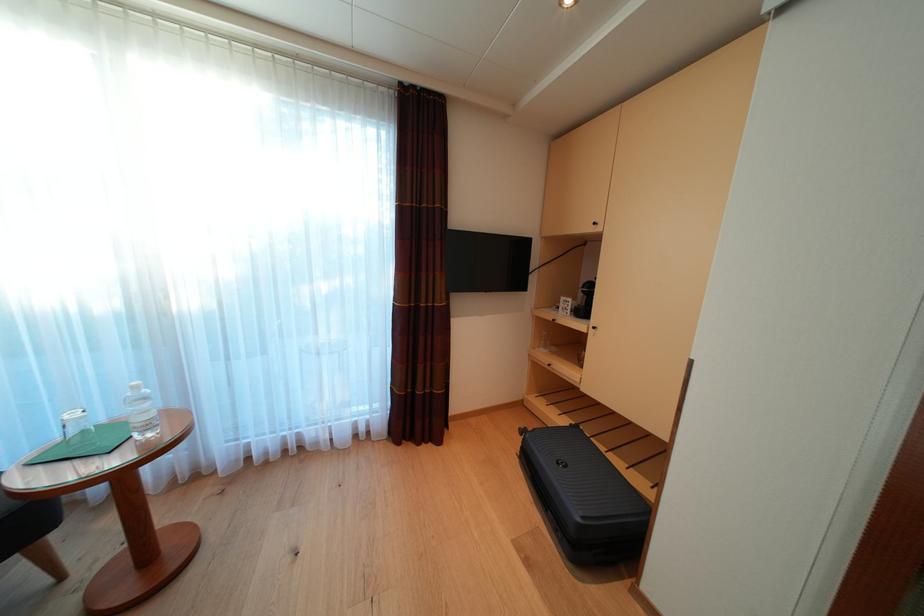
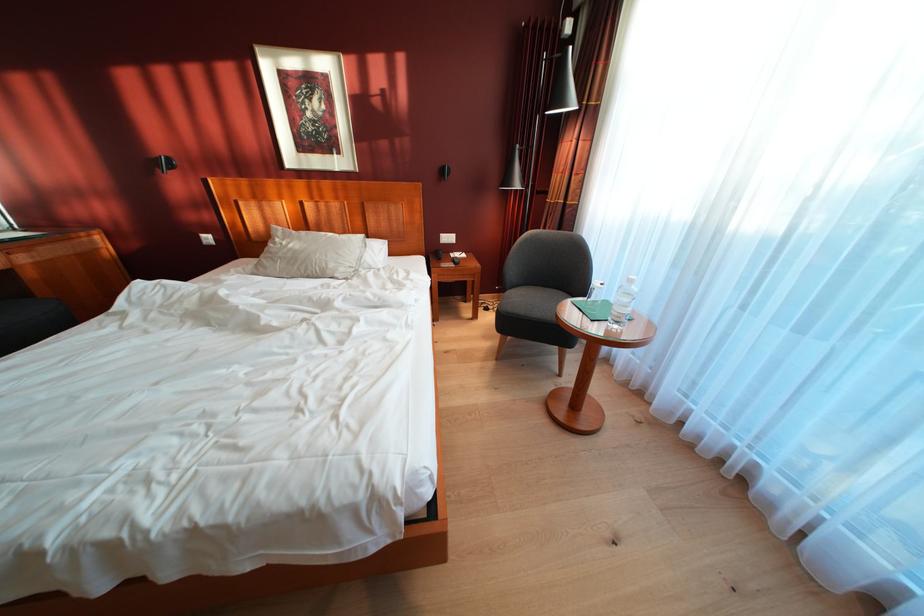
Locate, in the second image, the point that corresponds to [150,424] in the first image.

(625, 315)